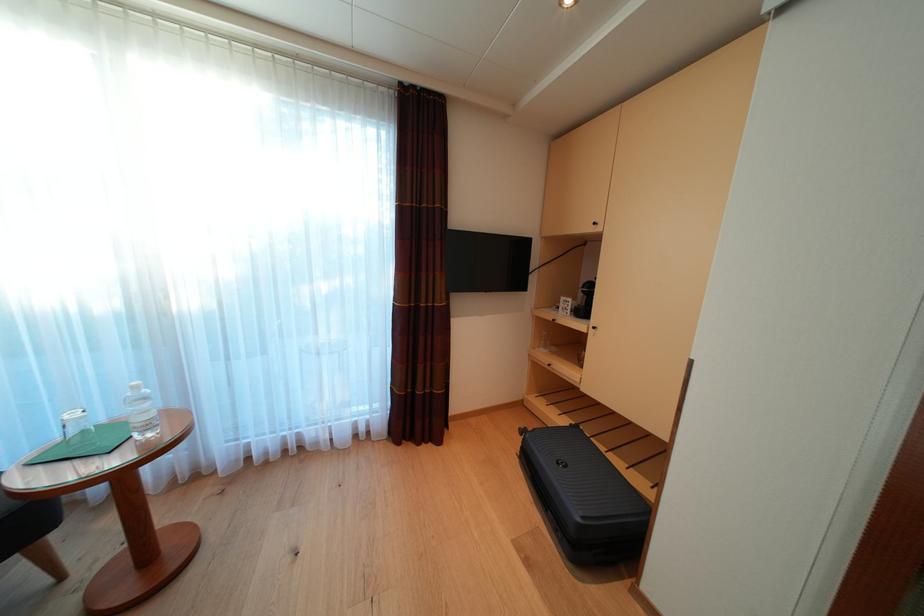
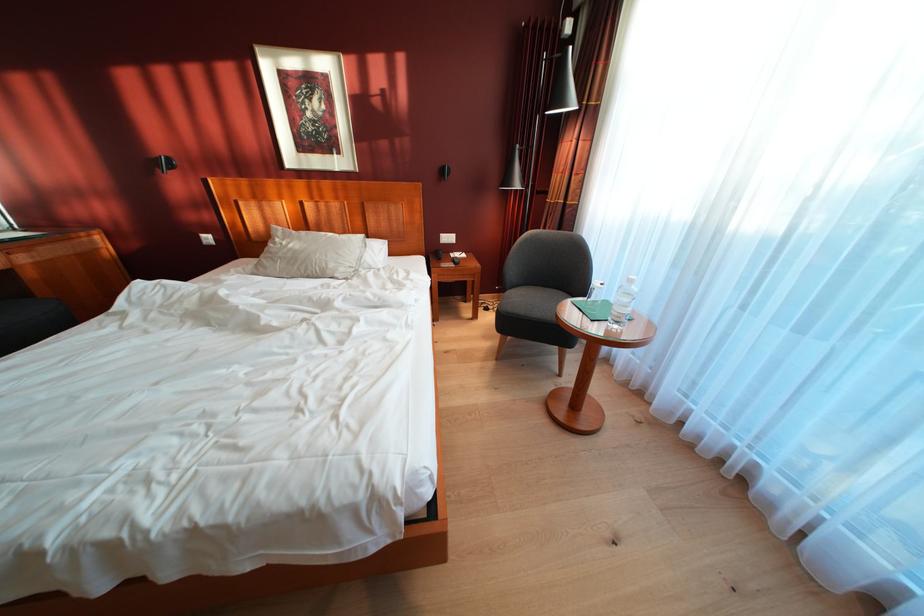
Locate, in the second image, the point that corresponds to [150,424] in the first image.

(625, 315)